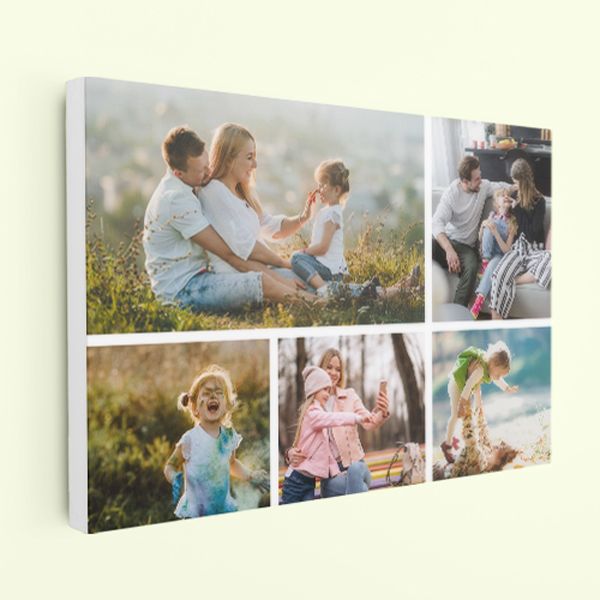
Identify the location of individual pictures in a collage. (225, 195), (495, 233), (483, 413), (310, 413), (215, 424).